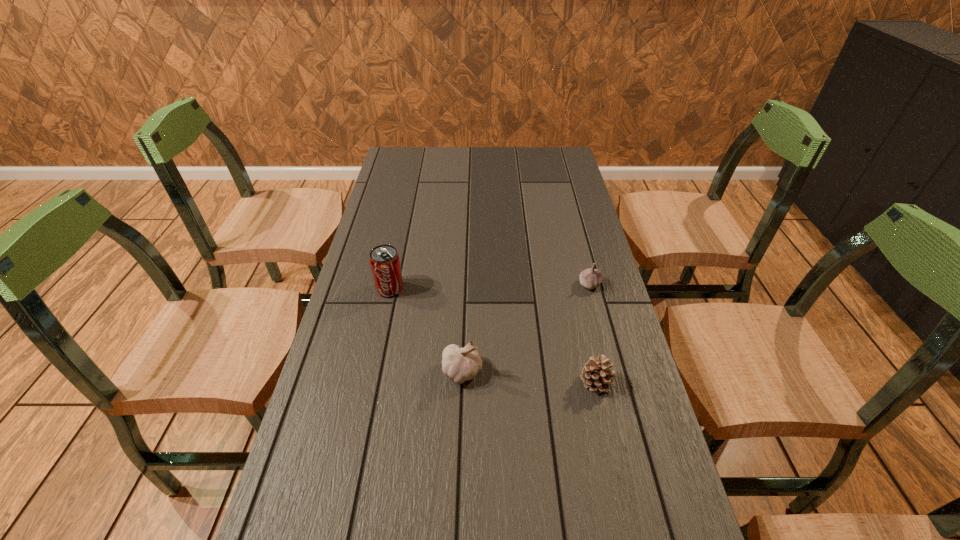
Where is `object that is at the left edge`? object that is at the left edge is located at coordinates (385, 265).

What are the coordinates of `pinecone at the right edge` in the screenshot? It's located at (596, 374).

Identify the location of garlic at the right edge. The width and height of the screenshot is (960, 540). (590, 278).

In the image, there is a desktop. Where is `vacant space at the far edge`? The height and width of the screenshot is (540, 960). vacant space at the far edge is located at coordinates (491, 151).

The width and height of the screenshot is (960, 540). In the image, there is a desktop. Find the location of `vacant area at the left edge`. vacant area at the left edge is located at coordinates (391, 298).

The height and width of the screenshot is (540, 960). In the image, there is a desktop. Find the location of `vacant space at the right edge`. vacant space at the right edge is located at coordinates (653, 417).

The width and height of the screenshot is (960, 540). I want to click on vacant area between the left garlic and the pinecone, so click(x=529, y=377).

Locate an element on the screen. vacant space that's between the pinecone and the right garlic is located at coordinates (593, 334).

Find the location of a particular element. vacant area between the leftmost object and the pinecone is located at coordinates (493, 335).

You are a GUI agent. You are given a task and a screenshot of the screen. Output one action in this format:
    pyautogui.click(x=<x>, y=<y>)
    Task: Click on the vacant area that lies between the right garlic and the leftmost object
    Image resolution: width=960 pixels, height=540 pixels.
    Given the screenshot: What is the action you would take?
    pyautogui.click(x=490, y=286)